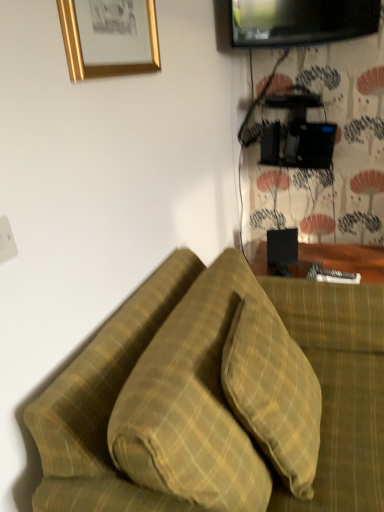
Question: Does gold metallic picture frame at upper left come in front of yellow plaid pillow at center, the second pillow when ordered from left to right?

Choices:
 (A) no
 (B) yes

Answer: (A)

Question: Can you confirm if gold metallic picture frame at upper left is smaller than yellow plaid pillow at center, the second pillow when ordered from left to right?

Choices:
 (A) yes
 (B) no

Answer: (A)

Question: Is gold metallic picture frame at upper left positioned beyond the bounds of yellow plaid pillow at center, the second pillow when ordered from left to right?

Choices:
 (A) yes
 (B) no

Answer: (A)

Question: Does gold metallic picture frame at upper left appear on the left side of yellow plaid pillow at center, the first pillow viewed from the right?

Choices:
 (A) no
 (B) yes

Answer: (B)

Question: Is gold metallic picture frame at upper left taller than yellow plaid pillow at center, the first pillow viewed from the right?

Choices:
 (A) yes
 (B) no

Answer: (B)

Question: Looking at their shapes, would you say yellow plaid pillow at center, the second pillow when ordered from left to right, is wider or thinner than green plaid pillow at center, which ranks as the first pillow in left-to-right order?

Choices:
 (A) wide
 (B) thin

Answer: (B)

Question: Based on their positions, is yellow plaid pillow at center, the first pillow viewed from the right, located to the left or right of green plaid pillow at center, positioned as the 2th pillow in right-to-left order?

Choices:
 (A) left
 (B) right

Answer: (B)

Question: From the image's perspective, is yellow plaid pillow at center, the first pillow viewed from the right, positioned above or below green plaid pillow at center, which ranks as the first pillow in left-to-right order?

Choices:
 (A) below
 (B) above

Answer: (B)

Question: In the image, is yellow plaid pillow at center, the first pillow viewed from the right, positioned in front of or behind green plaid pillow at center, which ranks as the first pillow in left-to-right order?

Choices:
 (A) behind
 (B) front

Answer: (A)

Question: In terms of width, does yellow plaid pillow at center, the second pillow when ordered from left to right, look wider or thinner when compared to black glossy tv at upper right?

Choices:
 (A) wide
 (B) thin

Answer: (A)

Question: Looking at the image, does yellow plaid pillow at center, the second pillow when ordered from left to right, seem bigger or smaller compared to black glossy tv at upper right?

Choices:
 (A) big
 (B) small

Answer: (A)

Question: In terms of height, does yellow plaid pillow at center, the first pillow viewed from the right, look taller or shorter compared to black glossy tv at upper right?

Choices:
 (A) tall
 (B) short

Answer: (A)

Question: From the image's perspective, is yellow plaid pillow at center, the first pillow viewed from the right, positioned above or below black glossy tv at upper right?

Choices:
 (A) above
 (B) below

Answer: (B)

Question: Is black glossy tv at upper right to the left or to the right of gold metallic picture frame at upper left in the image?

Choices:
 (A) left
 (B) right

Answer: (B)

Question: Considering the positions of point (370, 33) and point (127, 6), is point (370, 33) closer or farther from the camera than point (127, 6)?

Choices:
 (A) farther
 (B) closer

Answer: (A)